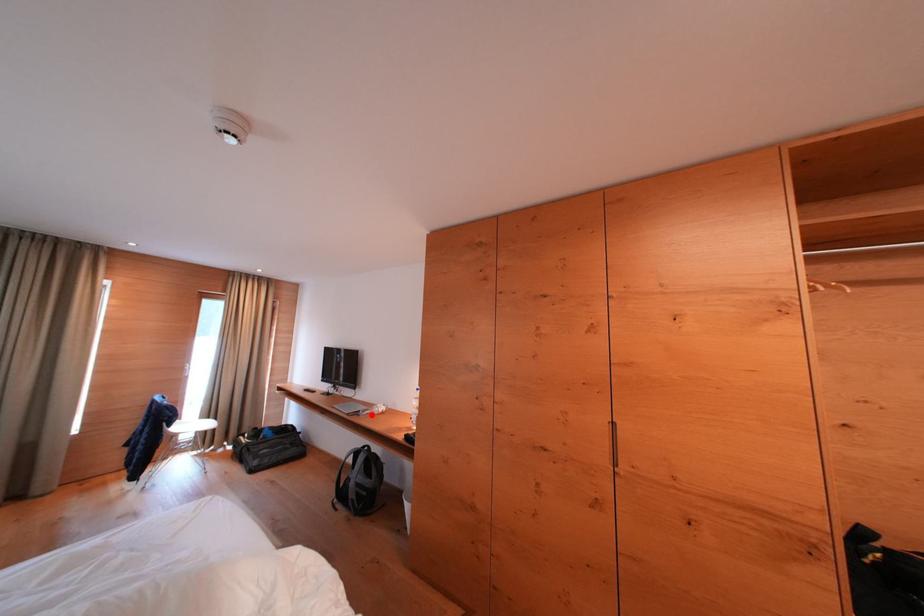
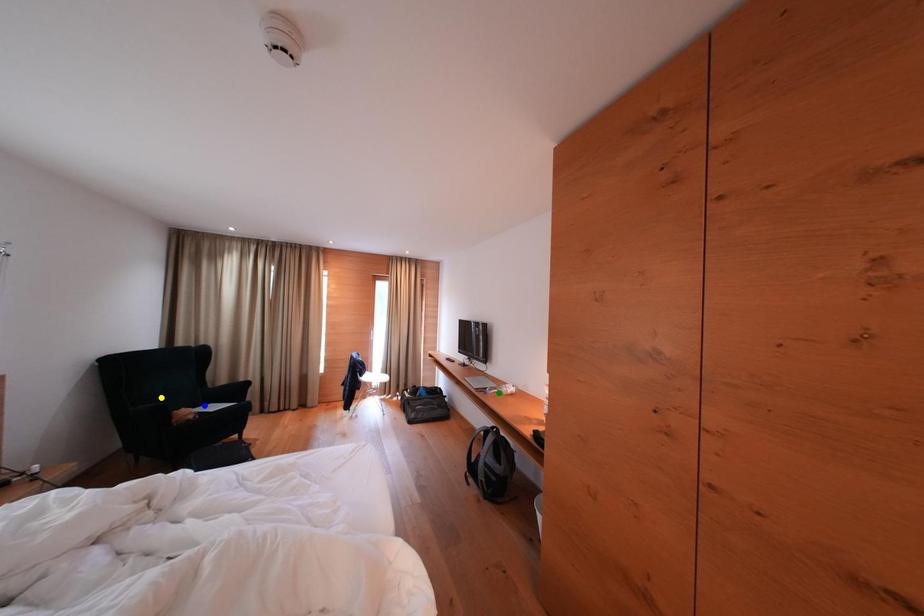
Question: I am providing you with two images of the same scene from different viewpoints. A red point is marked on the first image. You are given multiple points on the second image. Which point in image 2 represents the same 3d spot as the red point in image 1?

Choices:
 (A) green point
 (B) yellow point
 (C) blue point

Answer: (A)